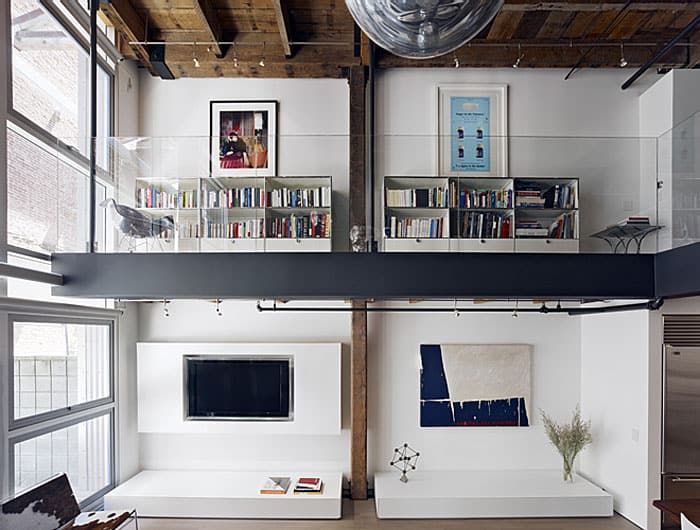
The height and width of the screenshot is (530, 700). Identify the location of frame. (230, 156).